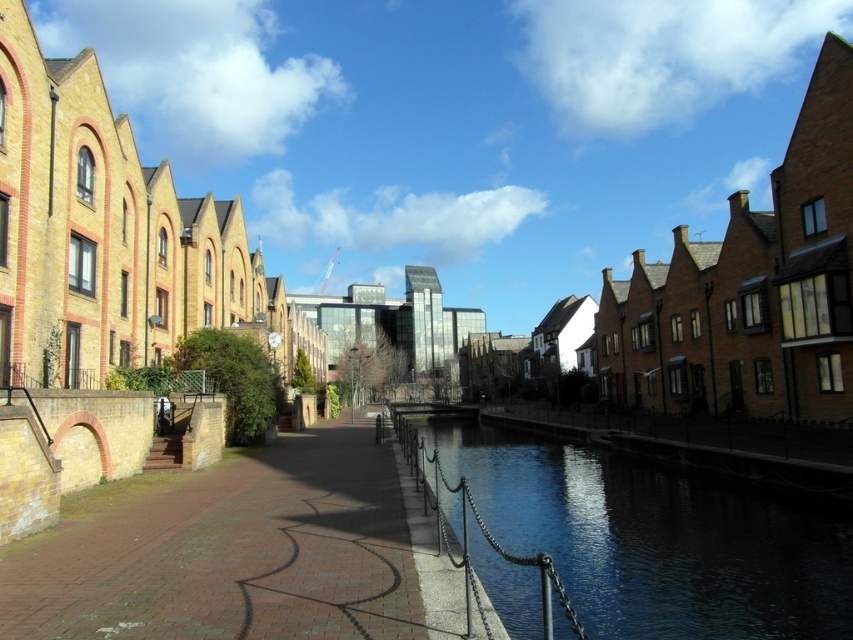
Between brick pavement at center and dark glassy water at center, which one is positioned higher?

brick pavement at center

The height and width of the screenshot is (640, 853). I want to click on brick pavement at center, so click(x=231, y=554).

The image size is (853, 640). Describe the element at coordinates (231, 554) in the screenshot. I see `brick pavement at center` at that location.

Locate an element on the screen. brick pavement at center is located at coordinates (231, 554).